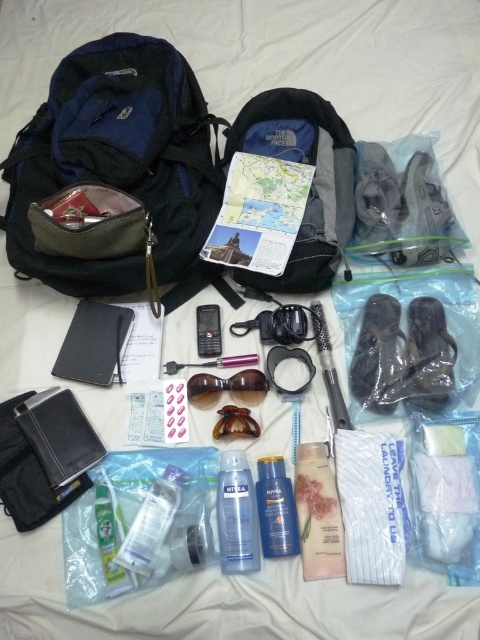
Question: Which object is farther from the camera taking this photo?

Choices:
 (A) pink matte lotion at center
 (B) matte black backpack at upper left
 (C) blue matte lotion at center

Answer: (B)

Question: Does clear plastic hairbrush at center appear under black plastic phone at center?

Choices:
 (A) yes
 (B) no

Answer: (A)

Question: Considering the relative positions of blue matte lotion at center and clear plastic hairbrush at center in the image provided, where is blue matte lotion at center located with respect to clear plastic hairbrush at center?

Choices:
 (A) right
 (B) left

Answer: (B)

Question: Which of the following is the closest to the observer?

Choices:
 (A) (271, 458)
 (B) (325, 385)

Answer: (A)

Question: Can you confirm if browny amber plastic goggles at center is positioned to the left of black plastic phone at center?

Choices:
 (A) yes
 (B) no

Answer: (B)

Question: Considering the real-world distances, which object is farthest from the matte black backpack at upper left?

Choices:
 (A) pink matte lotion at center
 (B) blue matte lotion at center
 (C) clear plastic hairbrush at center
 (D) black fabric backpack at center

Answer: (A)